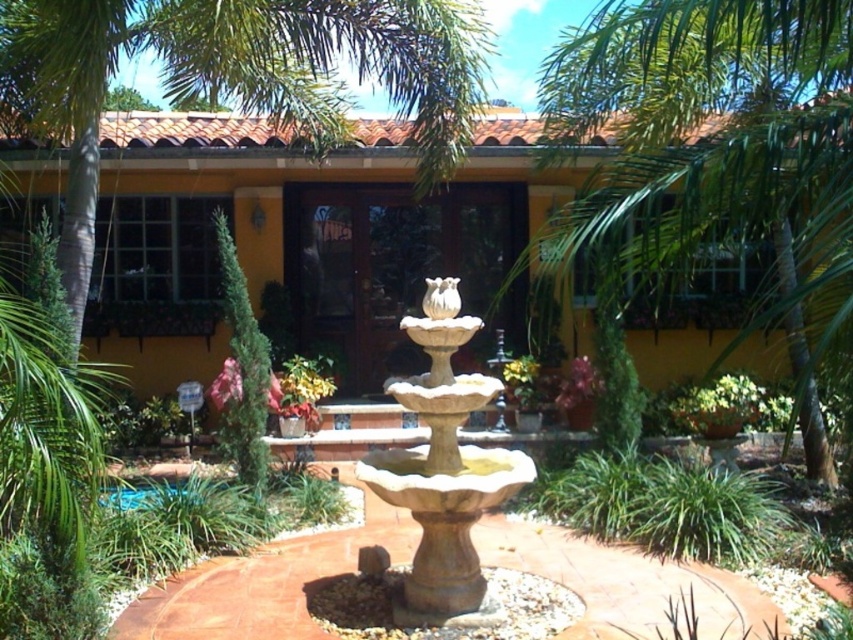
You are standing in front of the house looking at the garden. Which object is positioned higher relative to the other? The green leafy palm tree at upper right or the beige stone fountain at center?

The green leafy palm tree at upper right is positioned above the beige stone fountain at center, so it is higher.

Consider the image. You are standing in the garden and want to take a photo of the beige stone fountain at center. However, there is a green leafy palm tree at upper right in the way. Can you move closer to the fountain to avoid the tree blocking the view?

The green leafy palm tree at upper right is closer to the viewer than the beige stone fountain at center. Moving closer to the fountain would bring you nearer to the fountain but might not resolve the tree blocking the view since the tree is already in front of the fountain from your current position. You may need to reposition sideways or further back to find an angle where the tree is no longer obstructing the fountain.